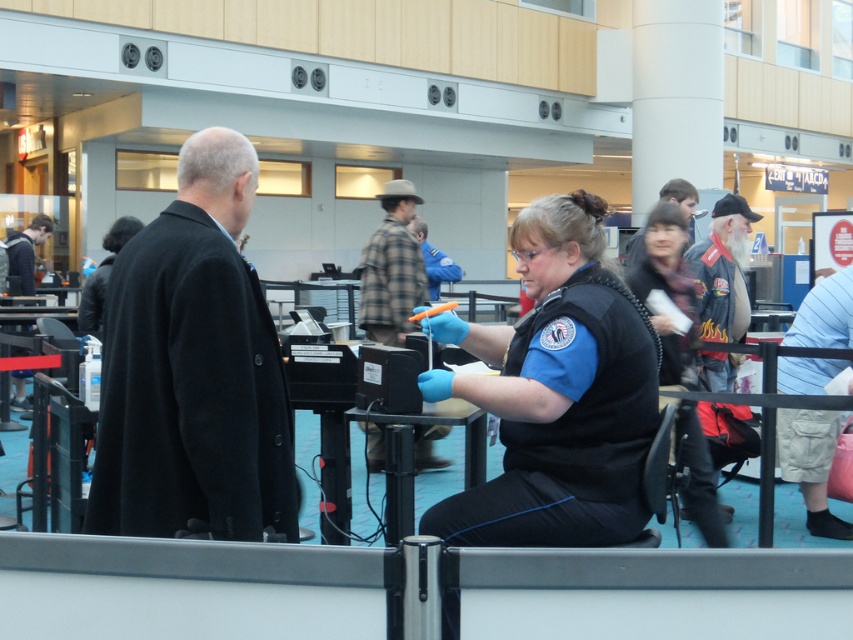
You are a traveler at the airport security checkpoint and need to retrieve your items. You see a plaid fabric shirt at center and a dark brown leather jacket at upper center. Which item is closer to you?

The plaid fabric shirt at center is closer to you because it is further to the viewer than the dark brown leather jacket at upper center.

You are a traveler at the airport security checkpoint. You have two items in your possession, the plaid fabric shirt at center and the dark brown leather jacket at upper center. The security officer is checking the size of your items. Which item is smaller?

The plaid fabric shirt at center is smaller compared to the dark brown leather jacket at upper center, so the plaid fabric shirt at center is the smaller item.